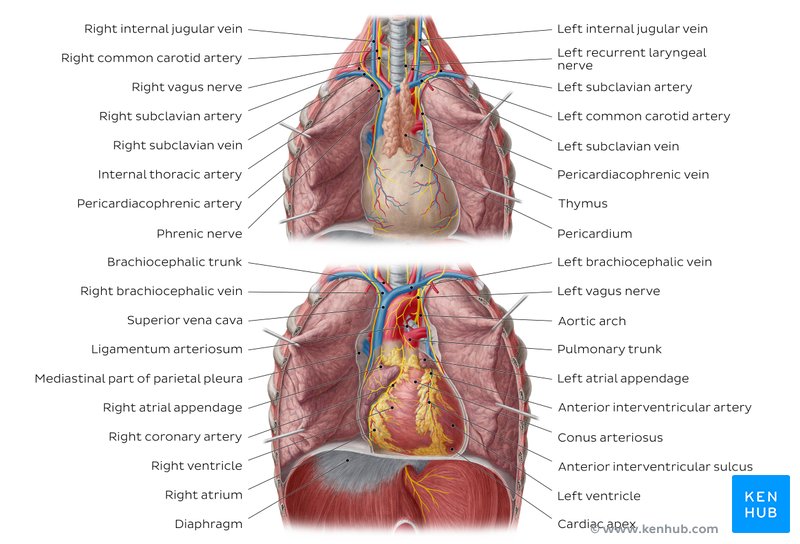
Locate an element on the screen. The image size is (800, 544). picture is located at coordinates (402, 485), (398, 108).